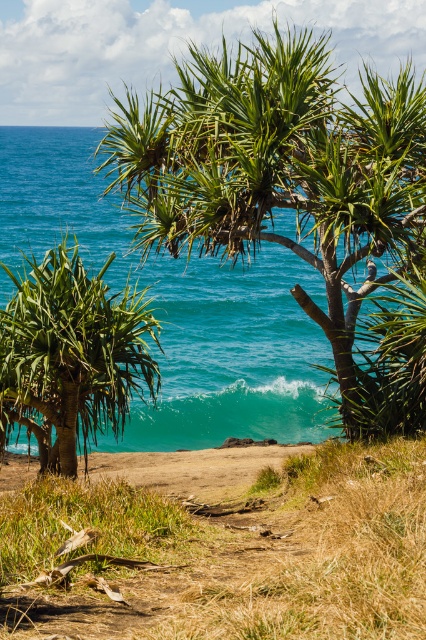
Who is positioned more to the left, teal glossy water at center or green leafy palm tree at center?

teal glossy water at center

Which is in front, point (299, 280) or point (97, 316)?

Positioned in front is point (97, 316).

Where is `teal glossy water at center`? teal glossy water at center is located at coordinates (178, 305).